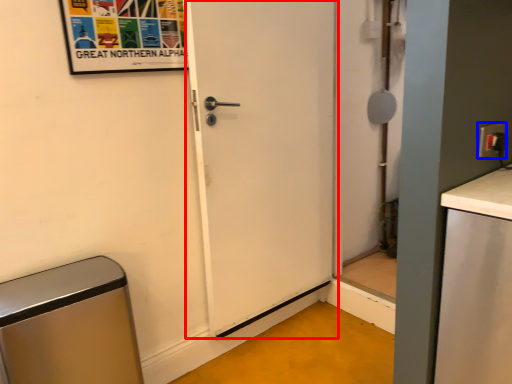
Question: Which object appears farthest to the camera in this image, door (highlighted by a red box) or electric outlet (highlighted by a blue box)?

Choices:
 (A) door
 (B) electric outlet

Answer: (A)